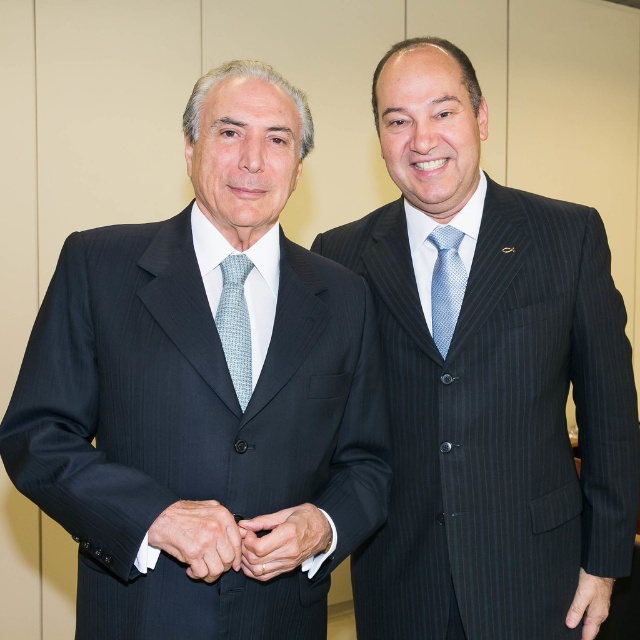
Question: Among these points, which one is farthest from the camera?

Choices:
 (A) (349, 428)
 (B) (582, 596)
 (C) (220, 312)

Answer: (B)

Question: Is smooth leather hand at center to the right of light blue textured tie at center from the viewer's perspective?

Choices:
 (A) yes
 (B) no

Answer: (B)

Question: Which object is farther from the camera taking this photo?

Choices:
 (A) white satin cufflinks at center
 (B) matte black suit at left

Answer: (B)

Question: Which of the following is the farthest from the observer?

Choices:
 (A) pinstriped suit at right
 (B) light blue dotted tie at right
 (C) matte black suit at left
 (D) matte black suit at lower right

Answer: (D)

Question: Is matte black suit at left bigger than pinstriped suit at right?

Choices:
 (A) yes
 (B) no

Answer: (B)

Question: Does pinstriped suit at right have a larger size compared to matte black suit at lower right?

Choices:
 (A) no
 (B) yes

Answer: (B)